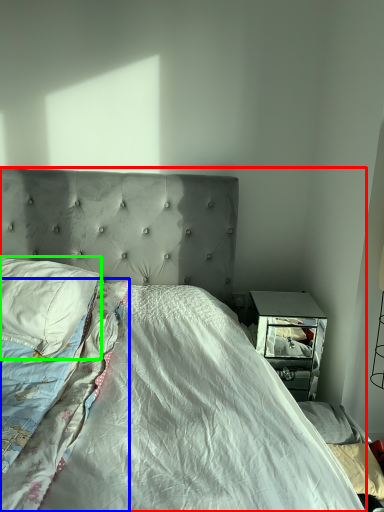
Question: Which object is the closest to the bed (highlighted by a red box)? Choose among these: blanket (highlighted by a blue box) or pillow (highlighted by a green box).

Choices:
 (A) blanket
 (B) pillow

Answer: (A)